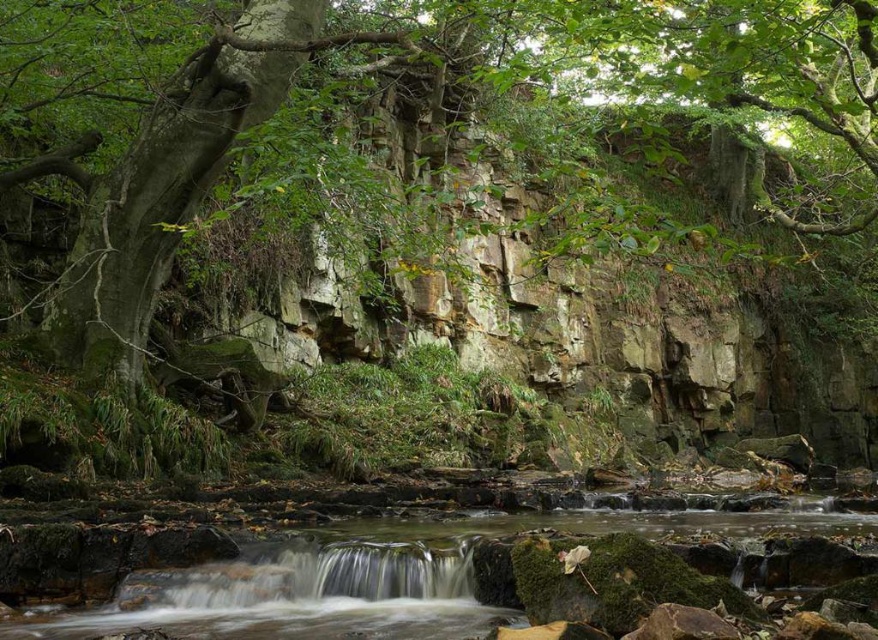
Question: Among these objects, which one is farthest from the camera?

Choices:
 (A) green mossy rocks at center
 (B) green rough bark tree at center

Answer: (B)

Question: Does green rough bark tree at center appear over green mossy rocks at center?

Choices:
 (A) yes
 (B) no

Answer: (A)

Question: In this image, where is green rough bark tree at center located relative to green mossy rocks at center?

Choices:
 (A) below
 (B) above

Answer: (B)

Question: Does green rough bark tree at center appear on the left side of green mossy rocks at center?

Choices:
 (A) yes
 (B) no

Answer: (B)

Question: Which of the following is the closest to the observer?

Choices:
 (A) (286, 584)
 (B) (776, 24)

Answer: (A)